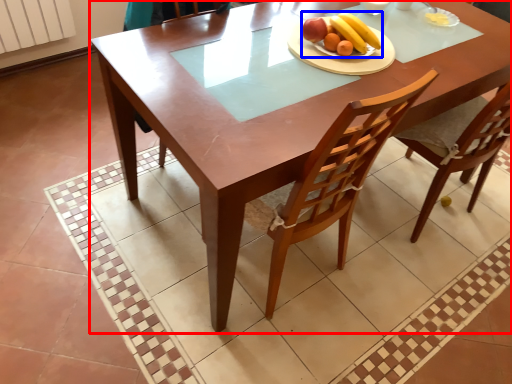
Question: Which point is closer to the camera, table (highlighted by a red box) or fruit salad (highlighted by a blue box)?

Choices:
 (A) table
 (B) fruit salad

Answer: (A)